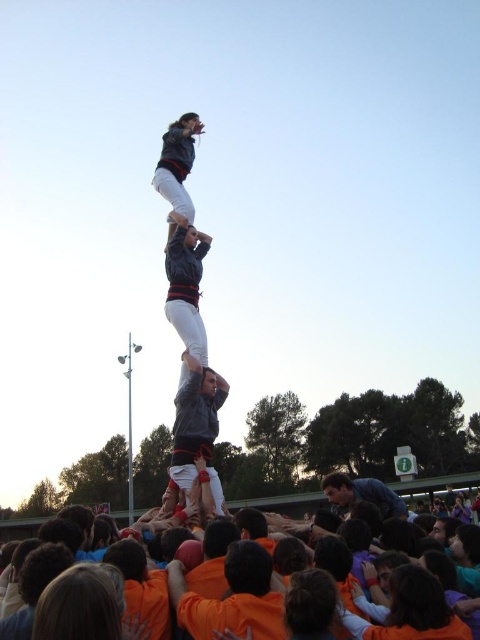
Does orange cotton shirt at lower center appear on the left side of blue denim shirt at center?

Indeed, orange cotton shirt at lower center is positioned on the left side of blue denim shirt at center.

Which is behind, point (180, 609) or point (403, 502)?

The point (403, 502) is behind.

Where is `orange cotton shirt at lower center`? Image resolution: width=480 pixels, height=640 pixels. orange cotton shirt at lower center is located at coordinates (232, 596).

Which is behind, point (463, 484) or point (192, 209)?

The point (463, 484) is behind.

Is orange cotton crowd at lower center to the right of matte gray jacket at center from the viewer's perspective?

Yes, orange cotton crowd at lower center is to the right of matte gray jacket at center.

Does point (330, 493) lie in front of point (157, 170)?

Yes, point (330, 493) is in front of point (157, 170).

Where is `orange cotton crowd at lower center`? The image size is (480, 640). orange cotton crowd at lower center is located at coordinates (441, 483).

Can you confirm if orange cotton crowd at lower center is smaller than blue denim shirt at center?

No, orange cotton crowd at lower center is not smaller than blue denim shirt at center.

Locate an element on the screen. orange cotton crowd at lower center is located at coordinates [441, 483].

Where is `orange cotton crowd at lower center`? This screenshot has width=480, height=640. orange cotton crowd at lower center is located at coordinates (441, 483).